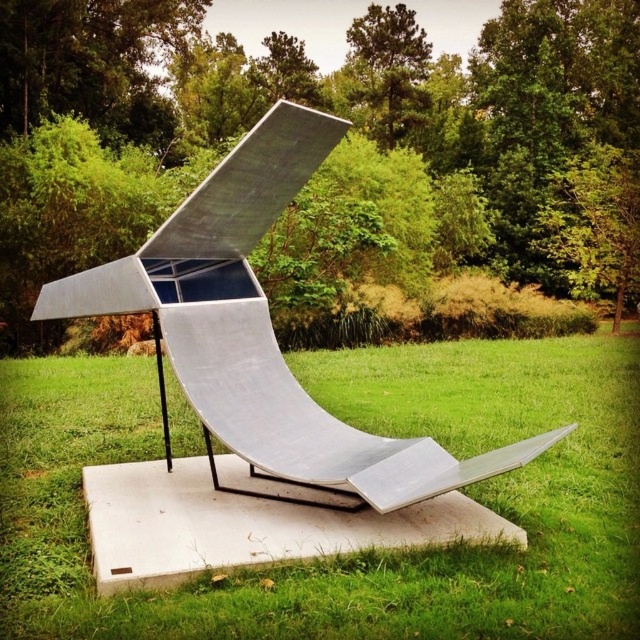
Is point (560, 484) farther from camera compared to point (380, 445)?

Yes, it is.

Between green grass at center and silver polished metal sculpture at center, which one has less height?

With less height is green grass at center.

Locate an element on the screen. green grass at center is located at coordinates (364, 554).

You are a GUI agent. You are given a task and a screenshot of the screen. Output one action in this format:
    pyautogui.click(x=<x>, y=<y>)
    Task: Click on the green grass at center
    
    Given the screenshot: What is the action you would take?
    pyautogui.click(x=364, y=554)